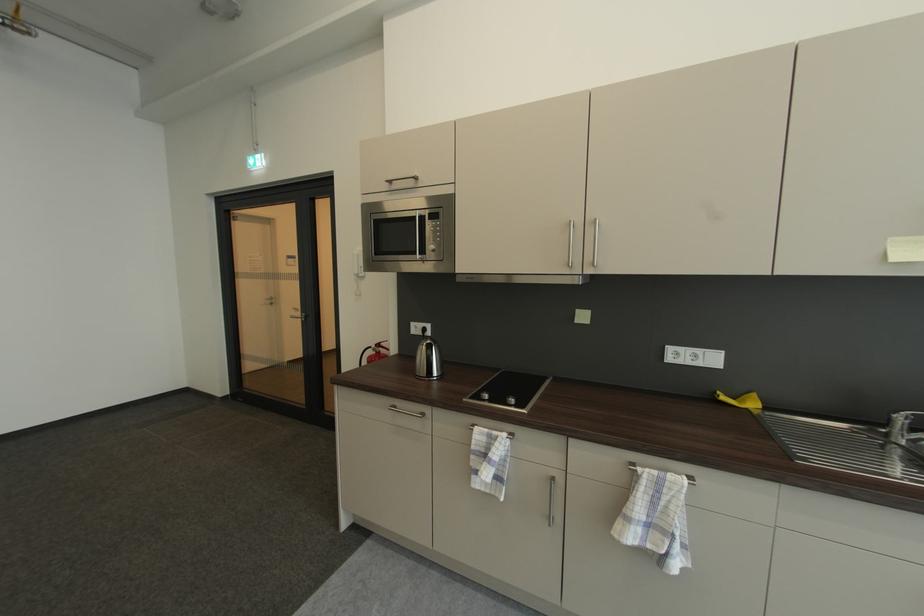
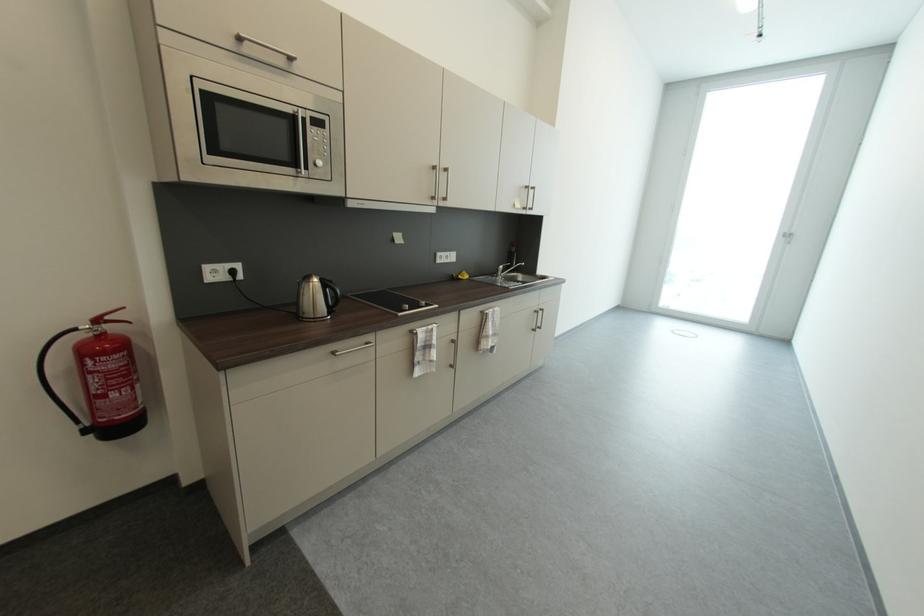
Where in the second image is the point corresponding to point 388,346 from the first image?

(116, 318)